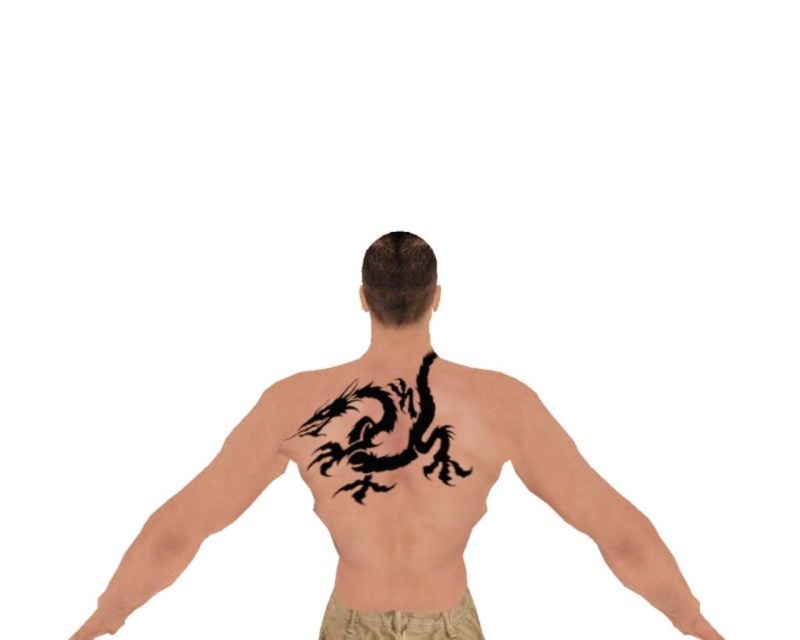
Between point (445, 560) and point (202, 499), which one is positioned behind?

Positioned behind is point (445, 560).

Is point (338, 410) farther from viewer compared to point (220, 497)?

No, (338, 410) is in front of (220, 497).

Find the location of a particular element. The height and width of the screenshot is (640, 800). black ink dragon tattoo at center is located at coordinates (398, 468).

What do you see at coordinates (398, 468) in the screenshot? I see `black ink dragon tattoo at center` at bounding box center [398, 468].

In the scene shown: Does black ink dragon tattoo at center lie behind tan fabric shorts at lower center?

That is False.

Is point (610, 538) positioned before point (364, 612)?

That is True.

Image resolution: width=800 pixels, height=640 pixels. Find the location of `black ink dragon tattoo at center`. black ink dragon tattoo at center is located at coordinates (398, 468).

Between black ink tattoo at upper left and tan fabric shorts at lower center, which one has less height?

With less height is tan fabric shorts at lower center.

Is point (106, 612) more distant than point (466, 624)?

Yes, it is behind point (466, 624).

This screenshot has width=800, height=640. I want to click on black ink tattoo at upper left, so click(x=202, y=506).